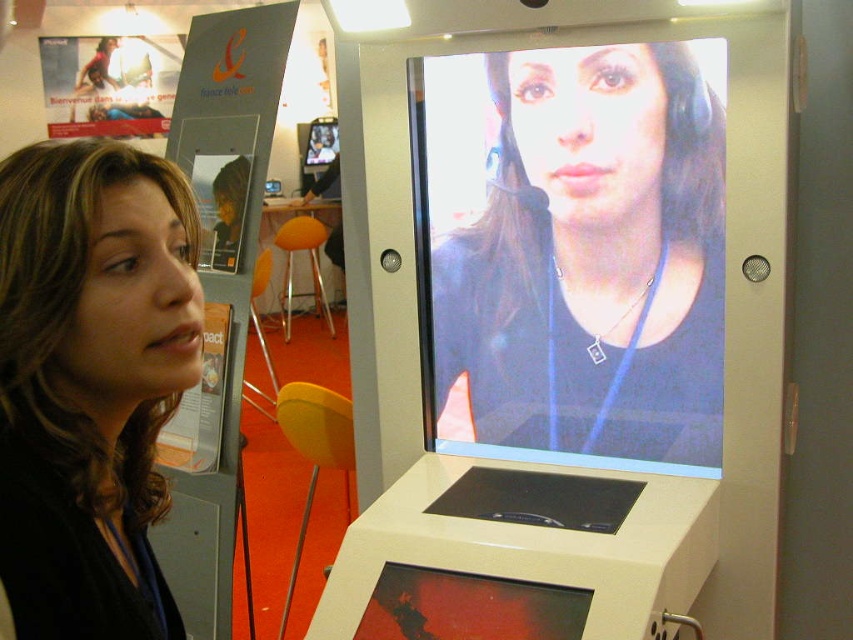
Question: Does matte black screen at center have a lesser width compared to matte black hair at left?

Choices:
 (A) yes
 (B) no

Answer: (B)

Question: Which point appears farthest from the camera in this image?

Choices:
 (A) (653, 272)
 (B) (44, 566)

Answer: (A)

Question: Can you confirm if matte black screen at center is bigger than matte black hair at left?

Choices:
 (A) no
 (B) yes

Answer: (B)

Question: Is the position of matte black screen at center less distant than that of matte black hair at left?

Choices:
 (A) yes
 (B) no

Answer: (B)

Question: Which object appears closest to the camera in this image?

Choices:
 (A) matte black screen at center
 (B) matte black hair at left

Answer: (B)